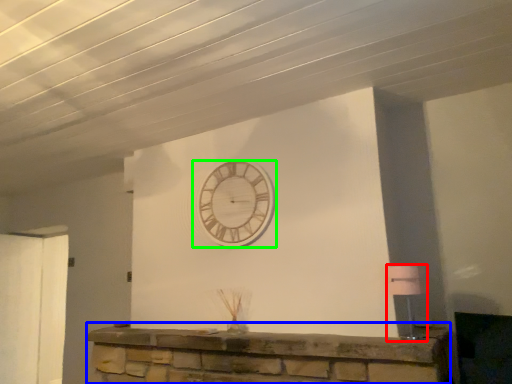
Question: Based on their relative distances, which object is farther from lamp (highlighted by a red box)? Choose from furniture (highlighted by a blue box) and wall clock (highlighted by a green box).

Choices:
 (A) furniture
 (B) wall clock

Answer: (B)